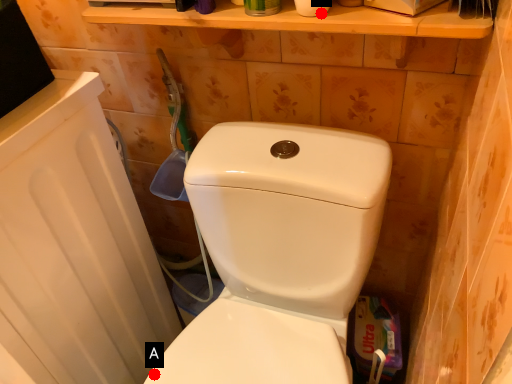
Question: Two points are circled on the image, labeled by A and B beside each circle. Among these points, which one is nearest to the camera?

Choices:
 (A) A is closer
 (B) B is closer

Answer: (B)